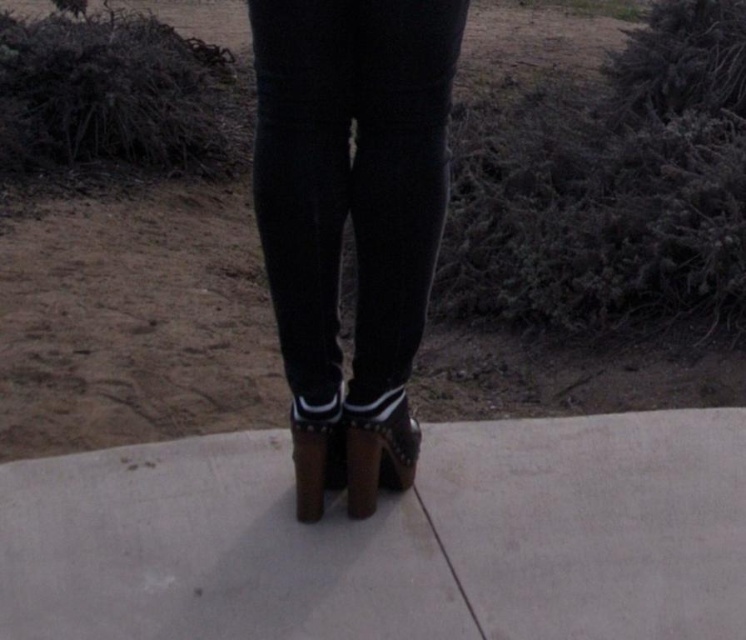
You are a fashion designer trying to create a cohesive outfit. You have a model wearing black matte leggings at center and brown leather sandal at center. Given that they are 30.10 centimeters apart, can you suggest a way to adjust their positioning to make the outfit look more harmonious?

Since the black matte leggings at center and brown leather sandal at center are 30.10 centimeters apart, you could bring them closer together to create a more balanced and harmonious look.